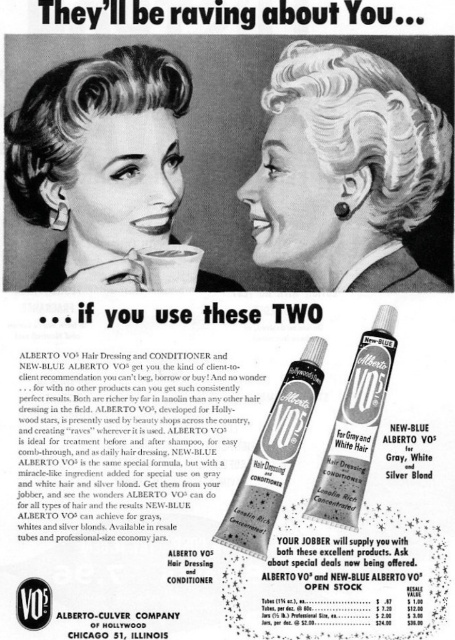
Between white curly hair at upper center and matte black tube at center, which one has more height?

Standing taller between the two is matte black tube at center.

Between point (438, 180) and point (298, 365), which one is positioned behind?

The point (298, 365) is behind.

The width and height of the screenshot is (455, 640). Identify the location of white curly hair at upper center. (367, 125).

Which is below, sleek blonde hair at center or matte black tube at center?

Positioned lower is matte black tube at center.

Is point (13, 176) positioned before point (316, 346)?

Yes.

Is point (87, 70) positioned behind point (274, 464)?

No, (87, 70) is in front of (274, 464).

Locate an element on the screen. sleek blonde hair at center is located at coordinates (82, 115).

Does silver metallic hair conditioner at center come behind white matte cup at center?

That is False.

Between silver metallic hair conditioner at center and white matte cup at center, which one is positioned lower?

silver metallic hair conditioner at center is below.

What do you see at coordinates (355, 428) in the screenshot?
I see `silver metallic hair conditioner at center` at bounding box center [355, 428].

You are a GUI agent. You are given a task and a screenshot of the screen. Output one action in this format:
    pyautogui.click(x=<x>, y=<y>)
    Task: Click on the silver metallic hair conditioner at center
    
    Given the screenshot: What is the action you would take?
    pyautogui.click(x=355, y=428)